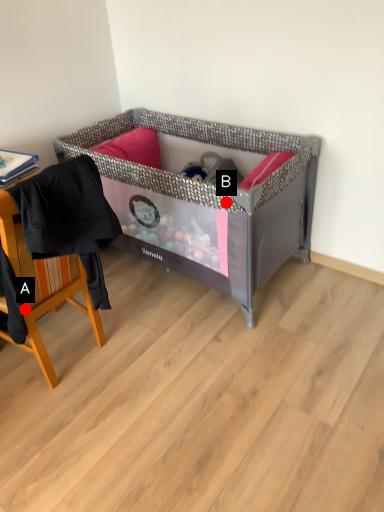
Question: Two points are circled on the image, labeled by A and B beside each circle. Among these points, which one is farthest from the camera?

Choices:
 (A) A is further
 (B) B is further

Answer: (B)